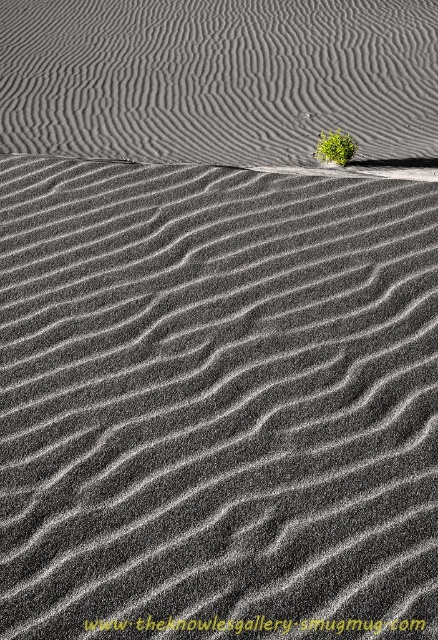
You are a geologist analyzing the sand dunes and notice the gray textured sand at upper center. What is the exact coordinate of this sand area?

The gray textured sand at upper center is located at point (218, 77).

You are a photographer trying to capture the height difference between the gray textured sand at upper center and the green leafy plant at upper center. Which object appears taller in the image?

The gray textured sand at upper center is taller than the green leafy plant at upper center according to the description.

You are a botanist studying the sand dunes and notice the gray textured sand at upper center and the green leafy plant at upper center. Which of these two objects is bigger in size?

The gray textured sand at upper center is larger in size compared to the green leafy plant at upper center.